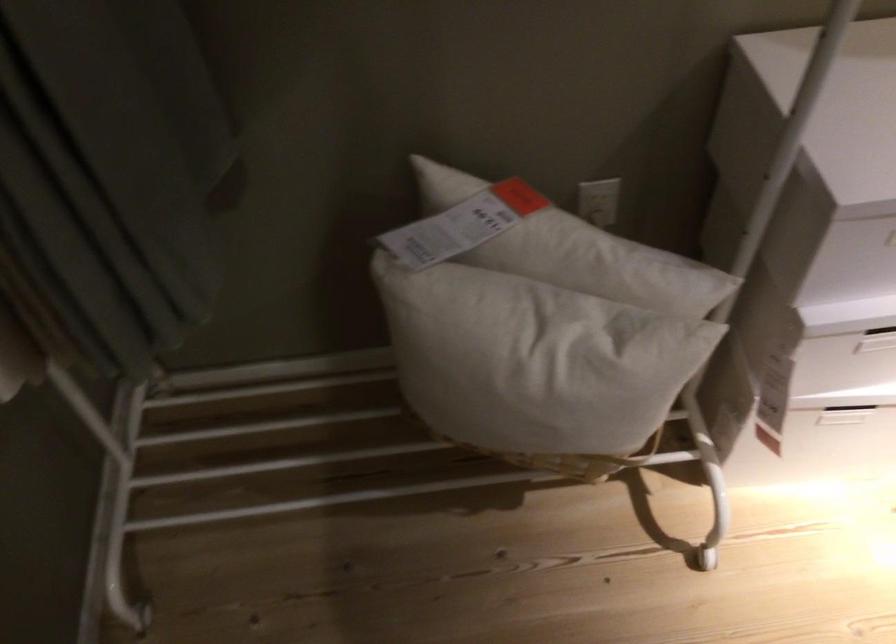
Find where to plugging in the electrical outlet. Please return your answer as a coordinate pair (x, y).

(598, 207)